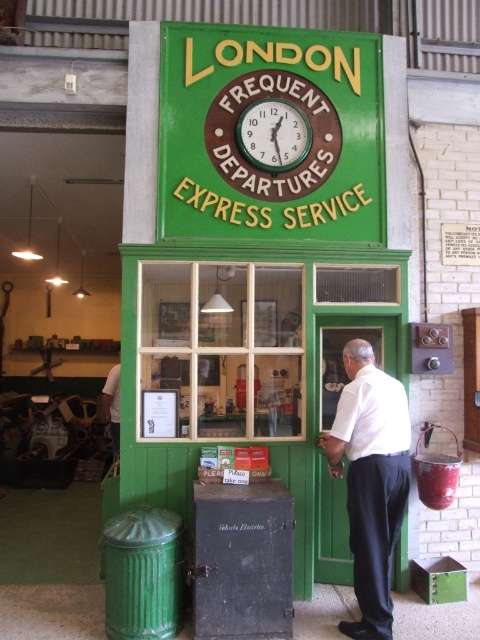
Question: Does white shirt at center have a lesser width compared to green painted wood clock at upper center?

Choices:
 (A) yes
 (B) no

Answer: (A)

Question: Can you confirm if white shirt at center is positioned below green painted wood clock at upper center?

Choices:
 (A) yes
 (B) no

Answer: (A)

Question: Does green wooden window at center appear over white shirt at center?

Choices:
 (A) yes
 (B) no

Answer: (A)

Question: Which point is closer to the camera?

Choices:
 (A) green painted wood clock at upper center
 (B) white shirt at center

Answer: (B)

Question: Which of the following is the farthest from the observer?

Choices:
 (A) green painted wood clock at upper center
 (B) white shirt at center

Answer: (A)

Question: Which of these objects is positioned closest to the green wooden window at center?

Choices:
 (A) green painted wood clock at upper center
 (B) white shirt at center

Answer: (B)